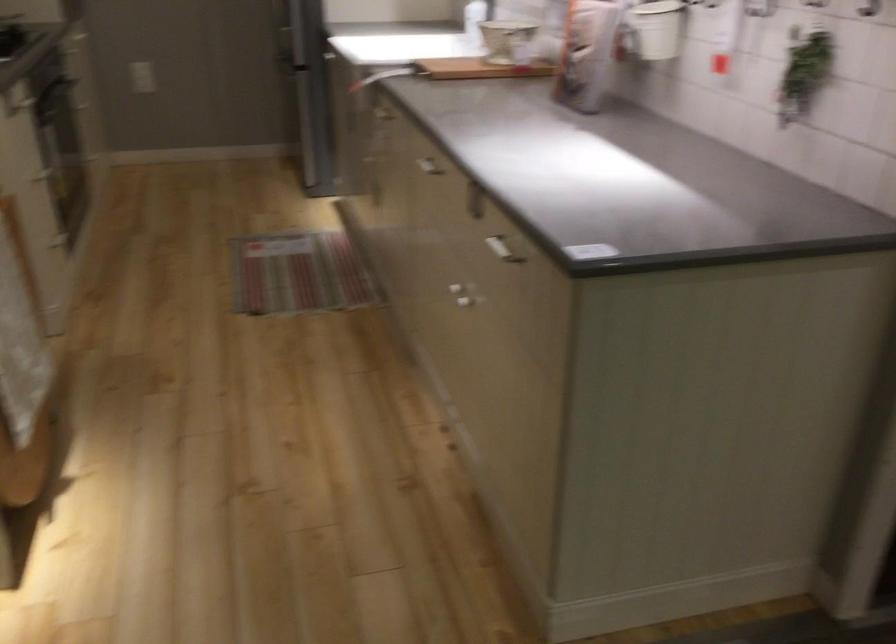
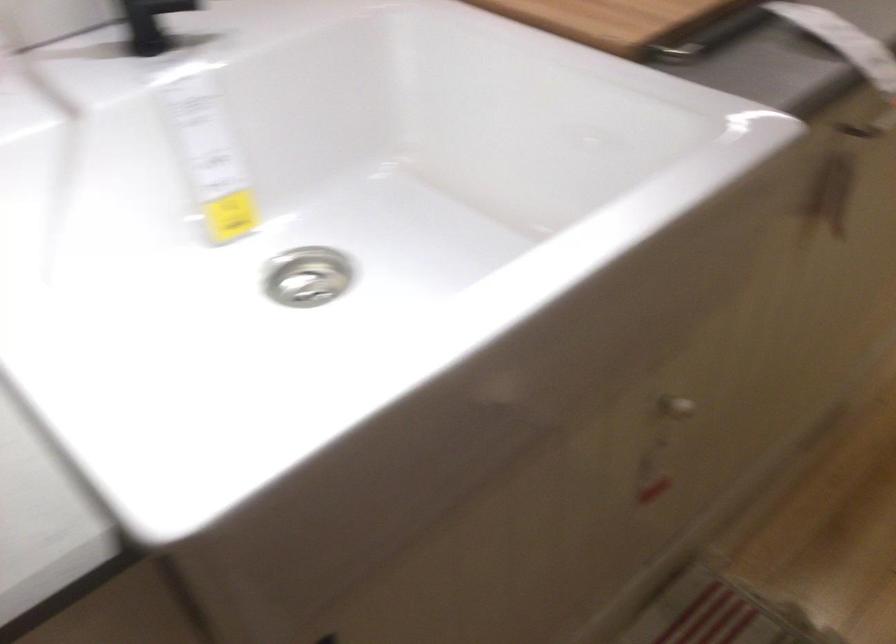
Locate, in the second image, the point that corresponds to pixel 376 169 in the first image.

(675, 408)